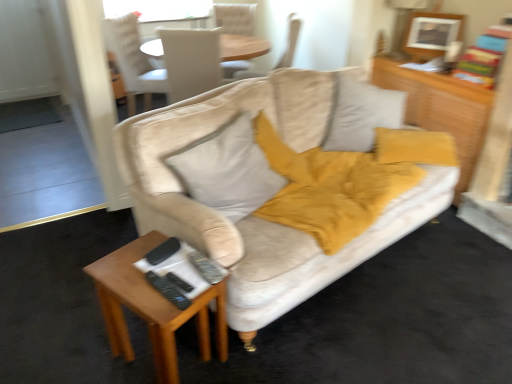
Question: From a real-world perspective, relative to wooden rectangular table at lower left, is beige fabric chair at upper center, the fourth chair from the left, vertically above or below?

Choices:
 (A) below
 (B) above

Answer: (B)

Question: From the image's perspective, is beige fabric chair at upper center, which ranks as the first chair in right-to-left order, located above or below wooden rectangular table at lower left?

Choices:
 (A) below
 (B) above

Answer: (B)

Question: Estimate the real-world distances between objects in this image. Which object is closer to the white fabric chair at upper center, the 4th chair viewed from the right?

Choices:
 (A) light beige fabric chair at upper center, arranged as the 3th chair when viewed from the left
 (B) beige fabric chair at upper center, arranged as the second chair when viewed from the left
 (C) wooden rectangular table at lower left
 (D) beige fabric chair at upper center, the fourth chair from the left
 (E) wooden dresser at upper right

Answer: (B)

Question: Which object is positioned farthest from the wooden rectangular table at lower left?

Choices:
 (A) soft white pillow at center
 (B) velvet beige couch at center
 (C) white fabric chair at upper center, the 4th chair viewed from the right
 (D) beige fabric chair at upper center, arranged as the second chair when viewed from the left
 (E) beige fabric chair at upper center, the fourth chair from the left

Answer: (C)